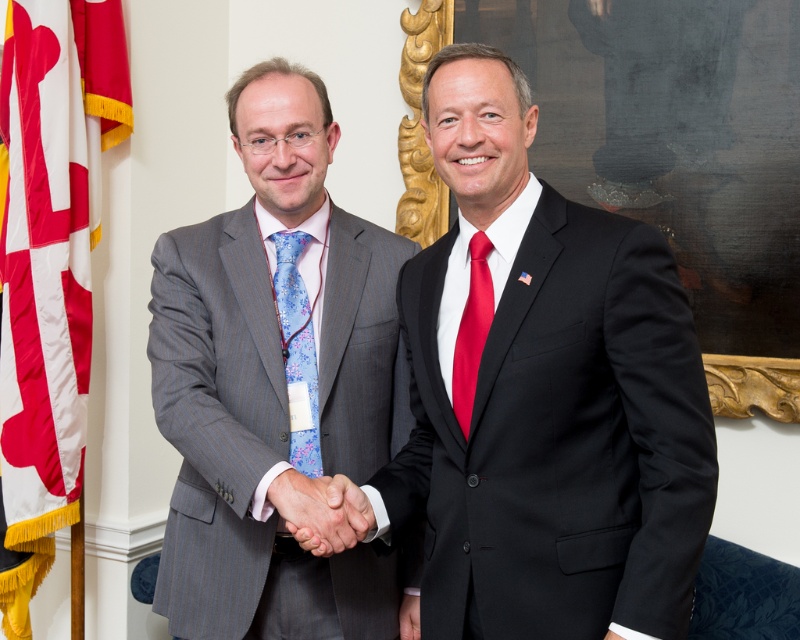
From the picture: You are a photographer taking a portrait of the two men. You notice the matte black suit at right and the blue floral silk tie at center. Which object is covering part of the other?

The matte black suit at right is positioned over blue floral silk tie at center, so the matte black suit at right is covering part of the blue floral silk tie at center.

Based on the coordinates provided, which object is located at point (274, 385) in the image?

The gray pinstripe suit at center is located at point (274, 385) in the image.

You are standing in the room where the two men are shaking hands. You need to locate the gray pinstripe suit at center. Where would you look?

The gray pinstripe suit at center is located at point (274, 385).